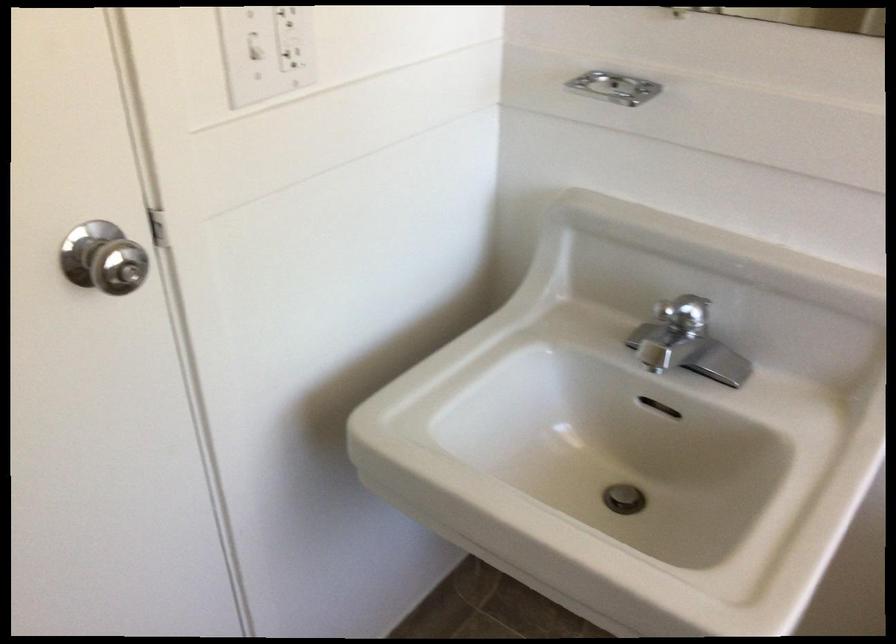
Describe the element at coordinates (254, 46) in the screenshot. I see `the light switch` at that location.